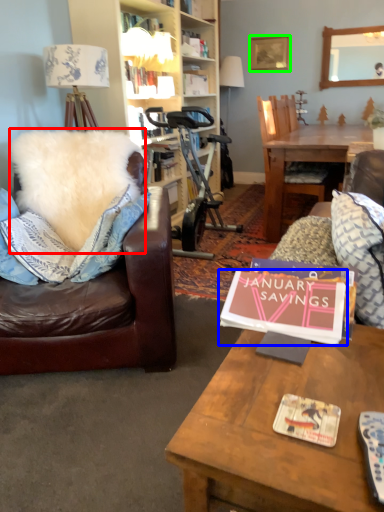
Question: Which object is positioned farthest from pillow (highlighted by a red box)? Select from book (highlighted by a blue box) and picture frame (highlighted by a green box).

Choices:
 (A) book
 (B) picture frame

Answer: (B)